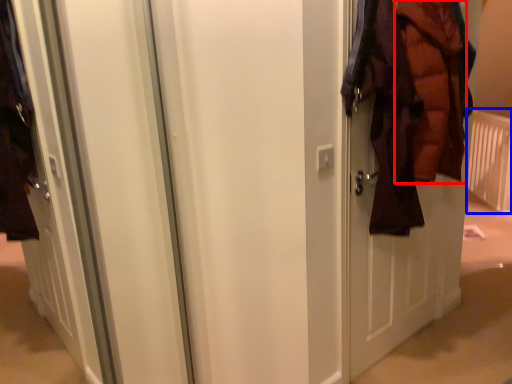
Question: Among these objects, which one is nearest to the camera, garment (highlighted by a red box) or radiator (highlighted by a blue box)?

Choices:
 (A) garment
 (B) radiator

Answer: (A)